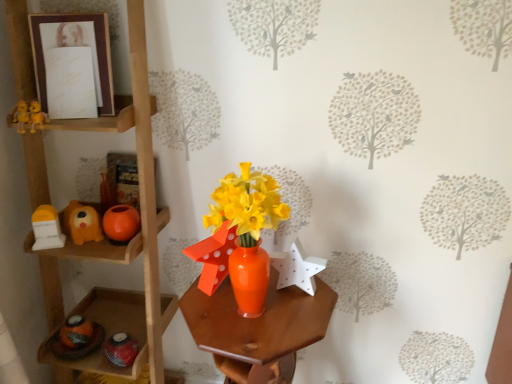
Question: Looking at the image, does orange matte ball at left, which appears as the second toy when viewed from the right, seem bigger or smaller compared to matte orange dog at left, positioned as the third toy in right-to-left order?

Choices:
 (A) small
 (B) big

Answer: (A)

Question: Visually, is orange matte ball at left, acting as the 2th toy starting from the left, positioned to the left or to the right of matte orange dog at left, positioned as the third toy in right-to-left order?

Choices:
 (A) left
 (B) right

Answer: (B)

Question: Which object is positioned farthest from the matte brown picture frame at upper left?

Choices:
 (A) matte orange dog at left, positioned as the third toy in right-to-left order
 (B) orange glossy vase at center
 (C) orange matte ball at left, acting as the 2th toy starting from the left
 (D) white matte star at center, the first toy viewed from the right
 (E) wooden shelf at left

Answer: (D)

Question: Which object is positioned farthest from the matte orange dog at left, positioned as the third toy in right-to-left order?

Choices:
 (A) wooden shelf at left
 (B) orange matte ball at left, acting as the 2th toy starting from the left
 (C) orange glossy vase at center
 (D) matte brown picture frame at upper left
 (E) white matte star at center, which is counted as the third toy, starting from the left

Answer: (E)